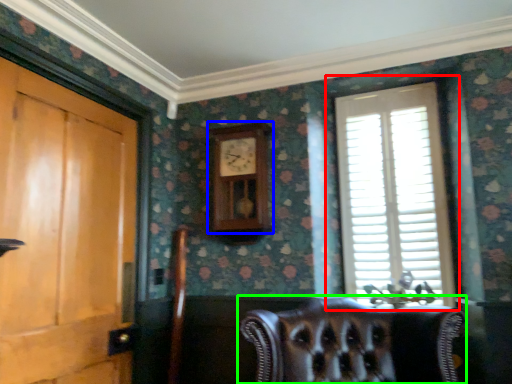
Question: Which object is the closest to the window (highlighted by a red box)? Choose among these: clock (highlighted by a blue box) or chair (highlighted by a green box).

Choices:
 (A) clock
 (B) chair

Answer: (A)